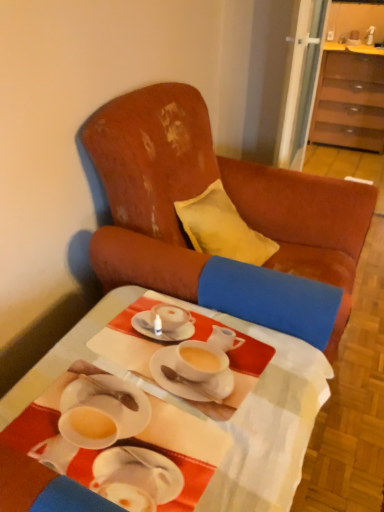
The height and width of the screenshot is (512, 384). I want to click on white glossy table at center, so click(x=256, y=425).

Where is `white glossy table at center`? white glossy table at center is located at coordinates (256, 425).

Choose the correct answer: Is distressed leather armchair at center inside brown wood cabinet at upper right or outside it?

The correct answer is: outside.

Is brown wood cabinet at upper right at the back of distressed leather armchair at center?

No, distressed leather armchair at center's orientation is not away from brown wood cabinet at upper right.

This screenshot has height=512, width=384. Identify the location of cabinetry above the distressed leather armchair at center (from the image's perspective). (350, 101).

Is point (322, 80) less distant than point (303, 408)?

No, (322, 80) is behind (303, 408).

From a real-world perspective, which object stands above the other?

brown wood cabinet at upper right.

Between brown wood cabinet at upper right and white glossy table at center, which one appears on the right side from the viewer's perspective?

From the viewer's perspective, brown wood cabinet at upper right appears more on the right side.

Based on the photo, is there a large distance between brown wood cabinet at upper right and white glossy table at center?

Yes, brown wood cabinet at upper right and white glossy table at center are quite far apart.

Looking at this image, is distressed leather armchair at center turned away from white glossy table at center?

No, white glossy table at center is not at the back of distressed leather armchair at center.

Considering the sizes of objects distressed leather armchair at center and white glossy table at center in the image provided, who is bigger, distressed leather armchair at center or white glossy table at center?

distressed leather armchair at center.

Would you consider distressed leather armchair at center to be distant from white glossy table at center?

They are positioned close to each other.

Between distressed leather armchair at center and white glossy table at center, which one appears on the right side from the viewer's perspective?

Positioned to the right is distressed leather armchair at center.

Considering the relative sizes of white glossy table at center and distressed leather armchair at center in the image provided, is white glossy table at center bigger than distressed leather armchair at center?

Actually, white glossy table at center might be smaller than distressed leather armchair at center.

From the picture: Which is more to the left, white glossy table at center or distressed leather armchair at center?

white glossy table at center.

From a real-world perspective, is white glossy table at center physically located above or below distressed leather armchair at center?

Clearly, from a real-world perspective, white glossy table at center is below distressed leather armchair at center.

Is point (209, 495) more distant than point (340, 95)?

No, (209, 495) is in front of (340, 95).

From a real-world perspective, who is located higher, white glossy table at center or brown wood cabinet at upper right?

In real-world perspective, brown wood cabinet at upper right is above.

Where is `desk lying on the left of brown wood cabinet at upper right`? The height and width of the screenshot is (512, 384). desk lying on the left of brown wood cabinet at upper right is located at coordinates (256, 425).

How much distance is there between white glossy table at center and brown wood cabinet at upper right?

white glossy table at center and brown wood cabinet at upper right are 10.86 feet apart from each other.

From their relative heights in the image, would you say brown wood cabinet at upper right is taller or shorter than distressed leather armchair at center?

brown wood cabinet at upper right is shorter than distressed leather armchair at center.

Does point (336, 98) come behind point (134, 165)?

Yes, point (336, 98) is farther from viewer.

Between brown wood cabinet at upper right and distressed leather armchair at center, which one appears on the left side from the viewer's perspective?

distressed leather armchair at center is more to the left.

Find the location of `chair in front of the brown wood cabinet at upper right`. chair in front of the brown wood cabinet at upper right is located at coordinates (203, 191).

Locate an element on the screen. desk on the left of brown wood cabinet at upper right is located at coordinates (256, 425).

Looking at the image, which one is located further to white glossy table at center, distressed leather armchair at center or brown wood cabinet at upper right?

brown wood cabinet at upper right is positioned further to the anchor white glossy table at center.

Estimate the real-world distances between objects in this image. Which object is closer to distressed leather armchair at center, white glossy table at center or brown wood cabinet at upper right?

white glossy table at center is closer to distressed leather armchair at center.

When comparing their distances from brown wood cabinet at upper right, does distressed leather armchair at center or white glossy table at center seem further?

white glossy table at center is further to brown wood cabinet at upper right.

Based on the photo, which object lies further to the anchor point white glossy table at center, brown wood cabinet at upper right or distressed leather armchair at center?

Among the two, brown wood cabinet at upper right is located further to white glossy table at center.

Which object lies further to the anchor point brown wood cabinet at upper right, white glossy table at center or distressed leather armchair at center?

white glossy table at center.

Considering their positions, is brown wood cabinet at upper right positioned further to distressed leather armchair at center than white glossy table at center?

brown wood cabinet at upper right is further to distressed leather armchair at center.

In order to click on chair between white glossy table at center and brown wood cabinet at upper right from front to back in this screenshot , I will do `click(203, 191)`.